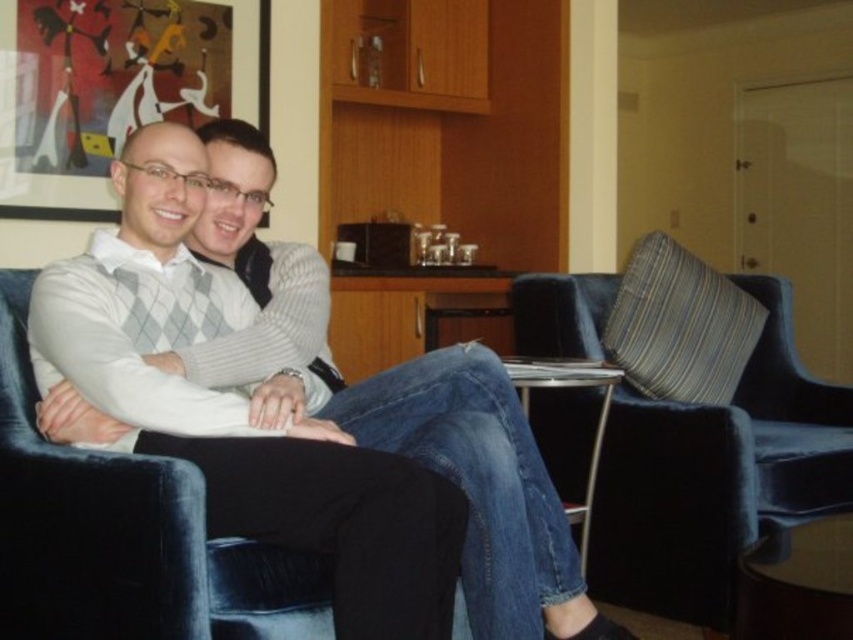
Question: Which point is closer to the camera?

Choices:
 (A) (380, 556)
 (B) (618, 589)

Answer: (A)

Question: Which object appears farthest from the camera in this image?

Choices:
 (A) velvet blue armchair at right
 (B) white sweater at center

Answer: (A)

Question: Is white sweater at center bigger than velvet blue armchair at right?

Choices:
 (A) yes
 (B) no

Answer: (B)

Question: Does white sweater at center appear over velvet blue armchair at right?

Choices:
 (A) yes
 (B) no

Answer: (A)

Question: Does white sweater at center have a lesser width compared to velvet blue armchair at right?

Choices:
 (A) yes
 (B) no

Answer: (B)

Question: Which point is closer to the camera?

Choices:
 (A) white sweater at center
 (B) velvet blue armchair at right

Answer: (A)